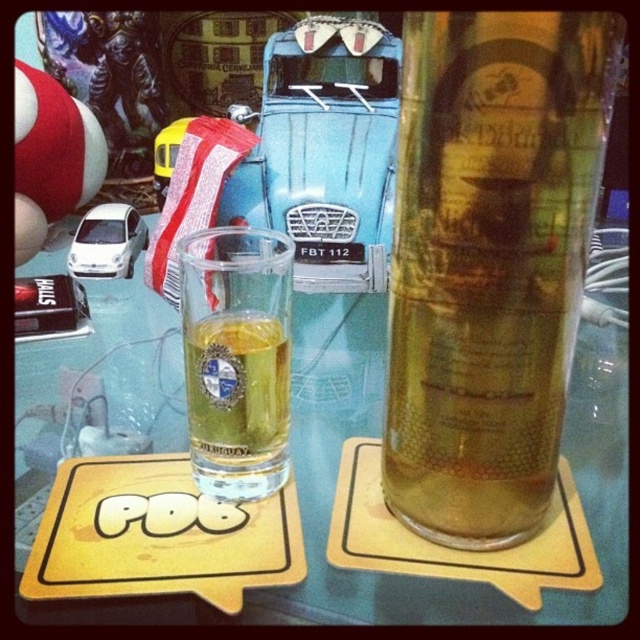
You are holding a smartphone camera and want to take a closeup photo of the translucent glass beer at center. The camera lens is currently 20 centimeters away from the glass. Can you focus on the glass without moving the camera?

The translucent glass beer at center is 21.75 centimeters away from the camera. Since the lens is only 20 centimeters away, you need to move the camera back to match the distance for proper focus.

You are at a bar and want to order a drink. You see two glasses in front of you, a translucent glass beer at center and a clear glass shot glass at center. Which glass would you choose if you want a larger portion?

The translucent glass beer at center has a larger size compared to the clear glass shot glass at center, so you should choose the translucent glass beer at center for a larger portion.